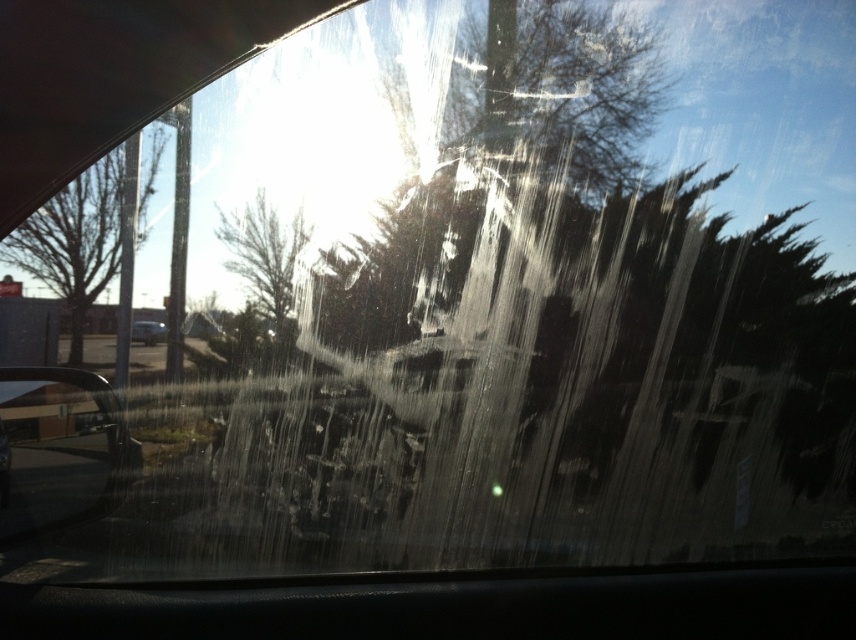
Question: Which of the following is the closest to the observer?

Choices:
 (A) metallic silver car at lower left
 (B) bare branches at left

Answer: (B)

Question: Based on their relative distances, which object is farther from the metallic silver car at lower left?

Choices:
 (A) bare branches at left
 (B) green leafy tree at center

Answer: (B)

Question: Can you confirm if green leafy tree at center is thinner than metallic silver car at lower left?

Choices:
 (A) no
 (B) yes

Answer: (A)

Question: Is bare branches at left to the left of metallic silver car at lower left from the viewer's perspective?

Choices:
 (A) yes
 (B) no

Answer: (A)

Question: Can you confirm if bare branches at left is smaller than green leafy tree at center?

Choices:
 (A) no
 (B) yes

Answer: (A)

Question: Which point is closer to the camera taking this photo?

Choices:
 (A) (153, 326)
 (B) (254, 220)

Answer: (B)